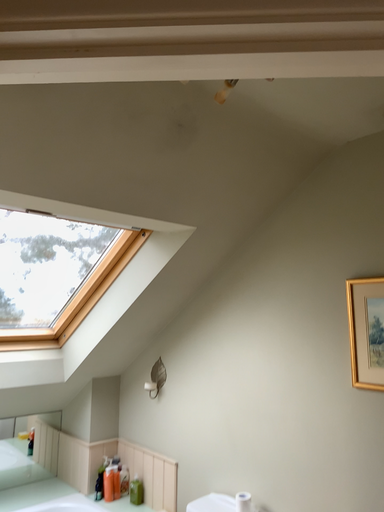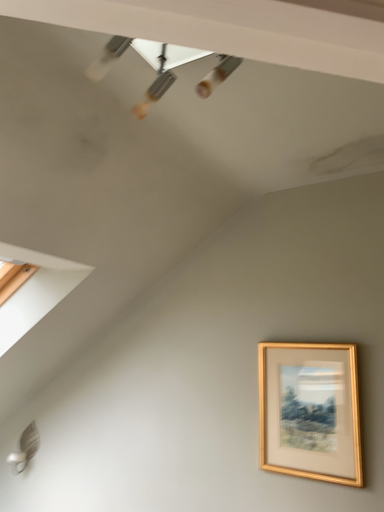
Question: Which way did the camera rotate in the video?

Choices:
 (A) rotated left
 (B) rotated right

Answer: (B)